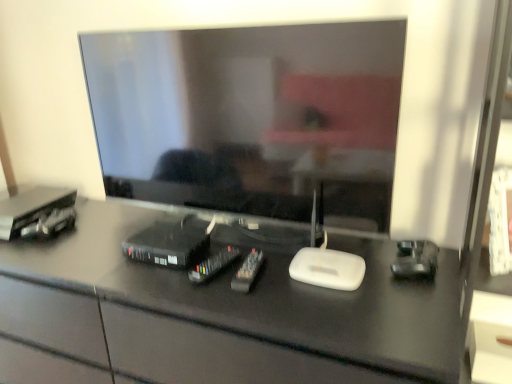
Identify the location of vacant region to the right of black plastic dvd player at lower left, which is the third equipment in right-to-left order. (232, 249).